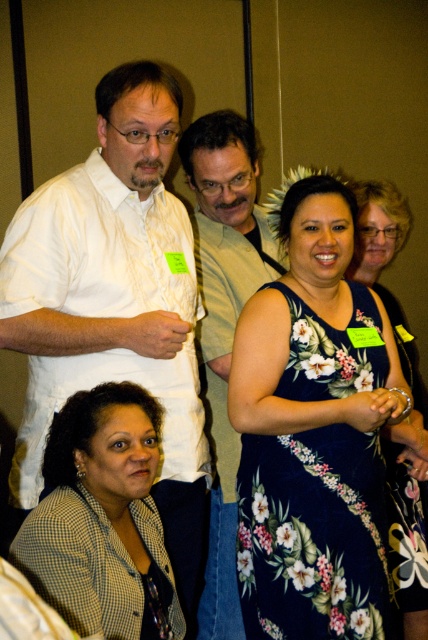
Question: Which point appears farthest from the camera in this image?

Choices:
 (A) pyautogui.click(x=55, y=320)
 (B) pyautogui.click(x=392, y=552)

Answer: (B)

Question: Which object is positioned closest to the dark blue floral dress at center?

Choices:
 (A) white shirt at upper left
 (B) checkered fabric blouse at lower left

Answer: (A)

Question: Is the position of dark blue floral dress at center more distant than that of green fabric shirt at center?

Choices:
 (A) yes
 (B) no

Answer: (B)

Question: Can you confirm if checkered fabric blouse at lower left is positioned to the right of floral print dress at center?

Choices:
 (A) no
 (B) yes

Answer: (A)

Question: Does green fabric shirt at center appear on the right side of floral print dress at center?

Choices:
 (A) yes
 (B) no

Answer: (B)

Question: Which is nearer to the green fabric shirt at center?

Choices:
 (A) floral print dress at center
 (B) dark blue floral dress at center
 (C) white shirt at upper left
 (D) checkered fabric blouse at lower left

Answer: (C)